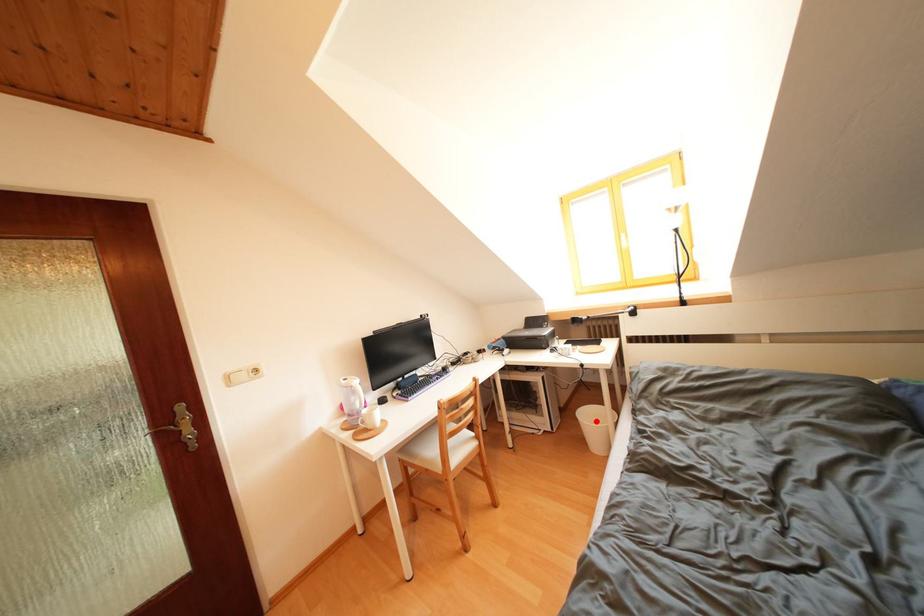
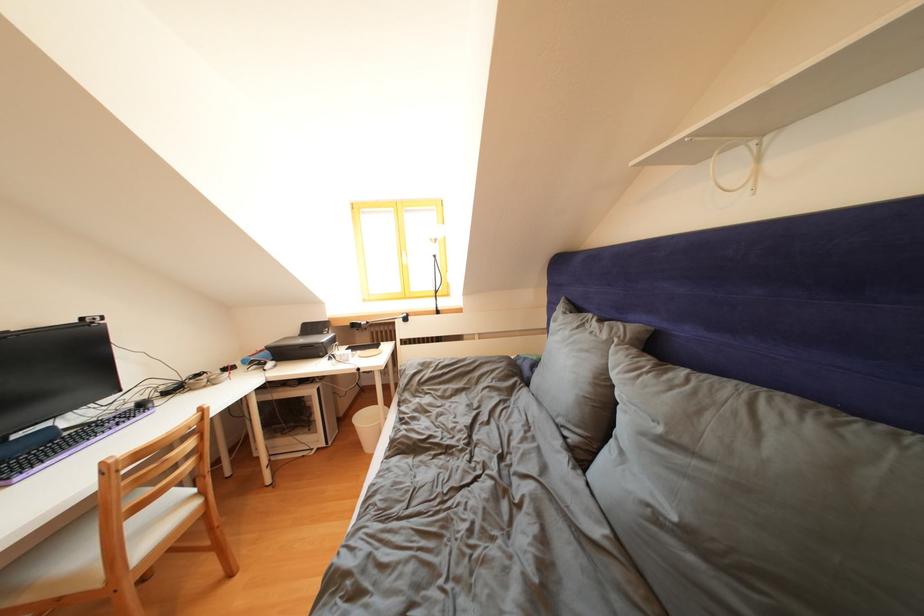
Locate, in the second image, the point that corresponds to the highlighted location in the first image.

(371, 424)